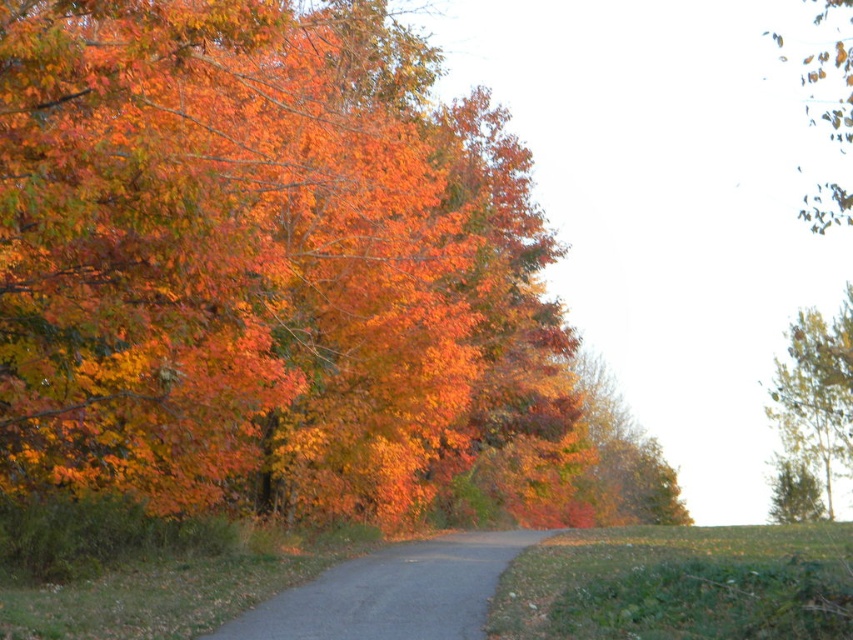
Question: In this image, where is shiny orange leaves at left located relative to smooth brown tree trunk at upper right?

Choices:
 (A) below
 (B) above

Answer: (B)

Question: Which point appears farthest from the camera in this image?

Choices:
 (A) (839, 404)
 (B) (657, 516)
 (C) (302, 596)

Answer: (B)

Question: Which of the following is the closest to the observer?

Choices:
 (A) smooth brown tree trunk at upper right
 (B) shiny orange leaves at left
 (C) orange matte tree at center

Answer: (B)

Question: Does shiny orange leaves at left appear under orange matte tree at center?

Choices:
 (A) yes
 (B) no

Answer: (B)

Question: Estimate the real-world distances between objects in this image. Which object is farther from the gray asphalt road at center?

Choices:
 (A) shiny orange leaves at left
 (B) orange matte tree at center

Answer: (B)

Question: Is smooth brown tree trunk at upper right positioned in front of orange matte tree at center?

Choices:
 (A) yes
 (B) no

Answer: (A)